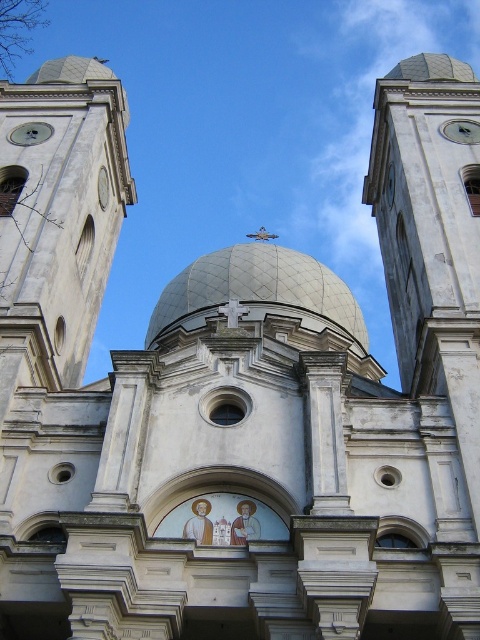
You are standing in front of the church and want to locate the white textured dome at center. According to the architectural layout, where would you find it in relation to the two bell towers?

The white textured dome at center is located at point coordinates approximately 0.455 on the x axis and 0.537 on the y axis. Since the two bell towers flank the central dome structure, the dome is positioned between them in the middle of the building.

You are an architect planning to add a new decorative element to the church. You have a choice between placing it on the white stone tower at upper right or the white textured dome at center. If you want the element to be more visible from the ground due to its size, which structure should you choose and why?

You should choose the white stone tower at upper right because its width surpasses that of the white textured dome at center, making it a larger structure and thus more visible from the ground.

You are standing in front of the church and want to know the distance to the point marked at coordinates point (397, 76). Can you estimate how far it is from where you are standing?

The point (397, 76) is 306.59 feet away from the viewer.